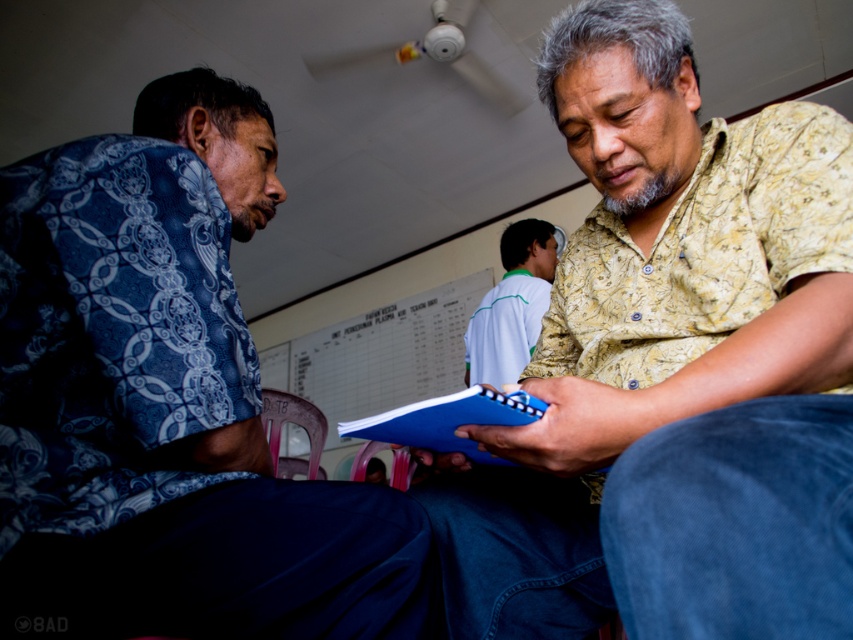
Question: In this image, where is yellow floral shirt at center located relative to pink plastic chair at lower center?

Choices:
 (A) below
 (B) above

Answer: (B)

Question: Can you confirm if blue matte notebook at center is bigger than pink plastic chair at lower center?

Choices:
 (A) yes
 (B) no

Answer: (B)

Question: Which object is the closest to the blue matte notebook at center?

Choices:
 (A) plastic chair at lower center
 (B) pink plastic chair at lower center
 (C) blue printed shirt at left

Answer: (C)

Question: Does light blue fabric shirt at center appear under pink plastic chair at lower center?

Choices:
 (A) yes
 (B) no

Answer: (B)

Question: Which point is farther to the camera?

Choices:
 (A) blue matte notebook at center
 (B) plastic chair at lower center
 (C) pink plastic chair at lower center

Answer: (B)

Question: Which object appears farthest from the camera in this image?

Choices:
 (A) blue matte notebook at center
 (B) yellow floral shirt at center

Answer: (A)